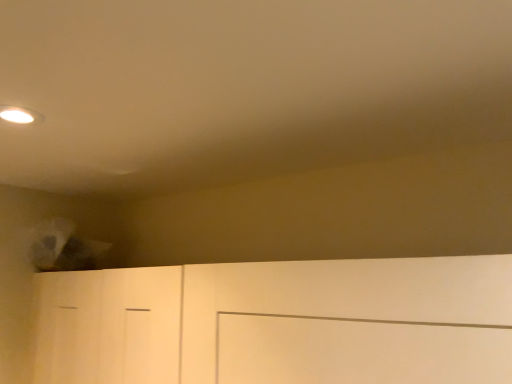
This screenshot has height=384, width=512. I want to click on white matte dresser at lower center, so click(280, 322).

Describe the element at coordinates (280, 322) in the screenshot. I see `white matte dresser at lower center` at that location.

Identify the location of white matte dresser at lower center. This screenshot has height=384, width=512. (280, 322).